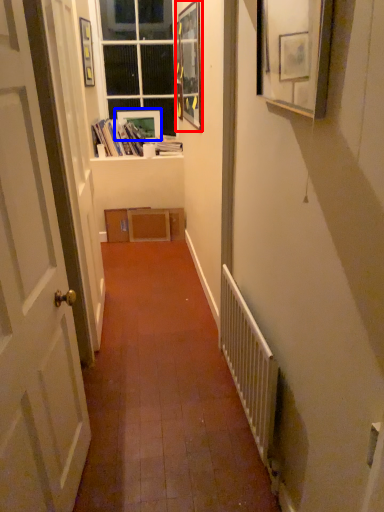
Question: Which point is closer to the camera, picture frame (highlighted by a red box) or picture frame (highlighted by a blue box)?

Choices:
 (A) picture frame
 (B) picture frame

Answer: (A)